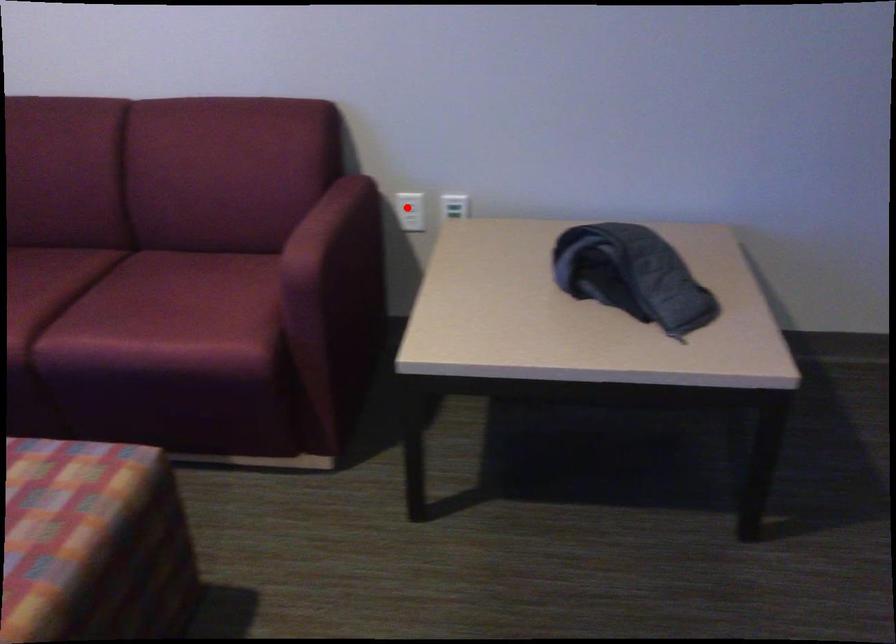
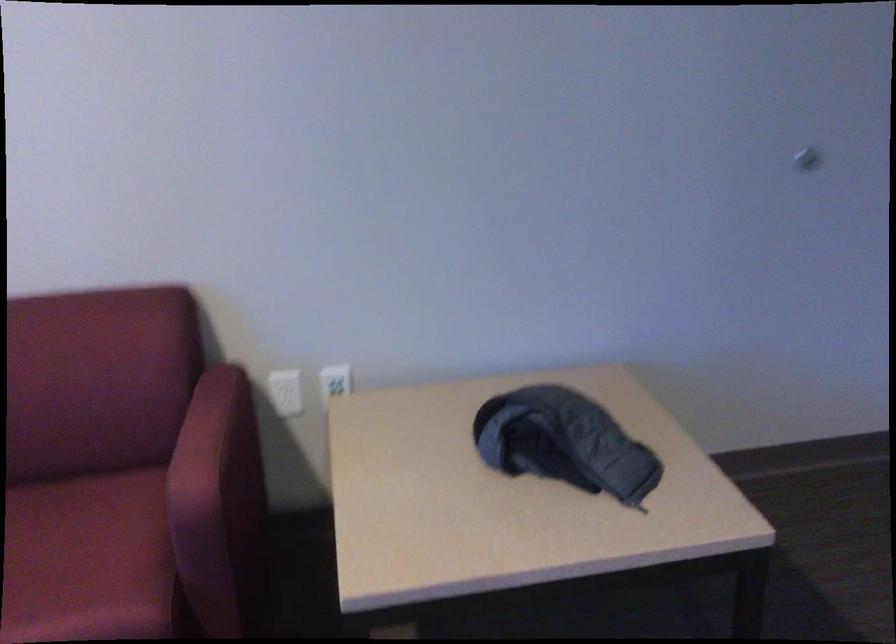
Question: A red point is marked in image1. In image2, is the corresponding 3D point closer to the camera or farther? Reply with the corresponding letter.

Choices:
 (A) The corresponding 3D point is closer.
 (B) The corresponding 3D point is farther.

Answer: (A)